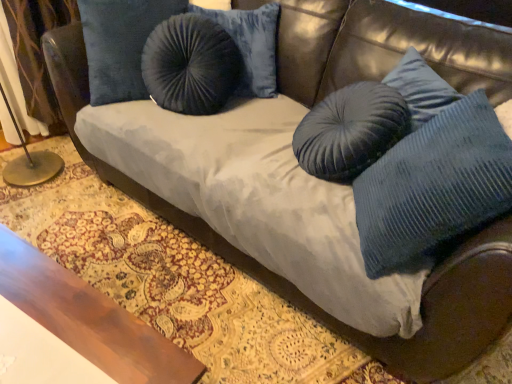
Question: Can you confirm if velvet curtain at left is smaller than wooden table at lower left?

Choices:
 (A) no
 (B) yes

Answer: (B)

Question: Could you tell me if velvet curtain at left is facing wooden table at lower left?

Choices:
 (A) no
 (B) yes

Answer: (B)

Question: Is velvet curtain at left shorter than wooden table at lower left?

Choices:
 (A) no
 (B) yes

Answer: (A)

Question: Would you consider velvet curtain at left to be distant from wooden table at lower left?

Choices:
 (A) yes
 (B) no

Answer: (A)

Question: Is wooden table at lower left completely or partially inside velvet curtain at left?

Choices:
 (A) no
 (B) yes

Answer: (A)

Question: Is velvet curtain at left wider than wooden table at lower left?

Choices:
 (A) no
 (B) yes

Answer: (A)

Question: Considering the relative sizes of velvet curtain at left and blue corduroy pillow at right in the image provided, is velvet curtain at left shorter than blue corduroy pillow at right?

Choices:
 (A) no
 (B) yes

Answer: (A)

Question: Can you confirm if velvet curtain at left is wider than blue corduroy pillow at right?

Choices:
 (A) yes
 (B) no

Answer: (A)

Question: Is velvet curtain at left next to blue corduroy pillow at right and touching it?

Choices:
 (A) no
 (B) yes

Answer: (A)

Question: Can you confirm if velvet curtain at left is thinner than blue corduroy pillow at right?

Choices:
 (A) no
 (B) yes

Answer: (A)

Question: Does velvet curtain at left lie in front of blue corduroy pillow at right?

Choices:
 (A) yes
 (B) no

Answer: (B)

Question: Does velvet curtain at left have a larger size compared to blue corduroy pillow at right?

Choices:
 (A) yes
 (B) no

Answer: (B)

Question: Can you confirm if wooden table at lower left is taller than velvet curtain at left?

Choices:
 (A) yes
 (B) no

Answer: (B)